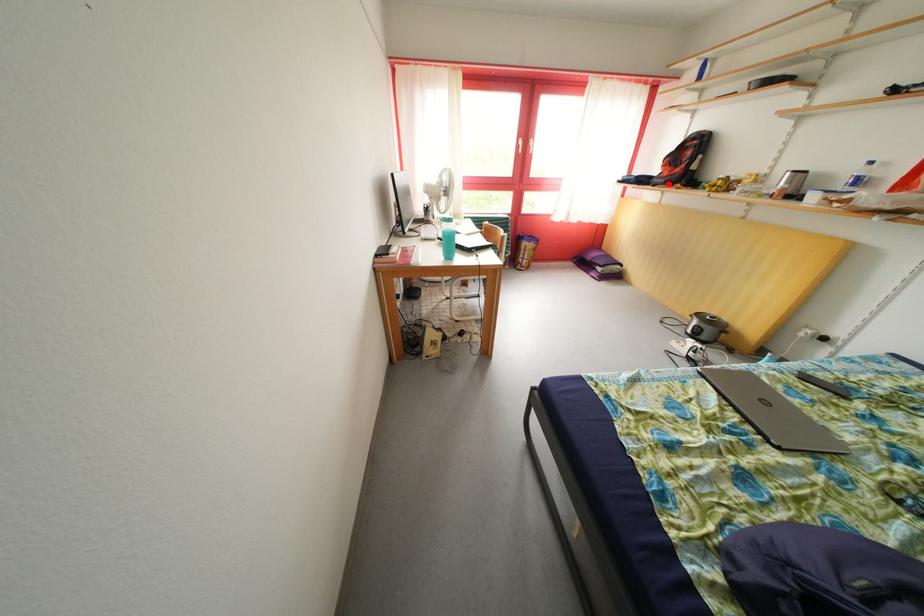
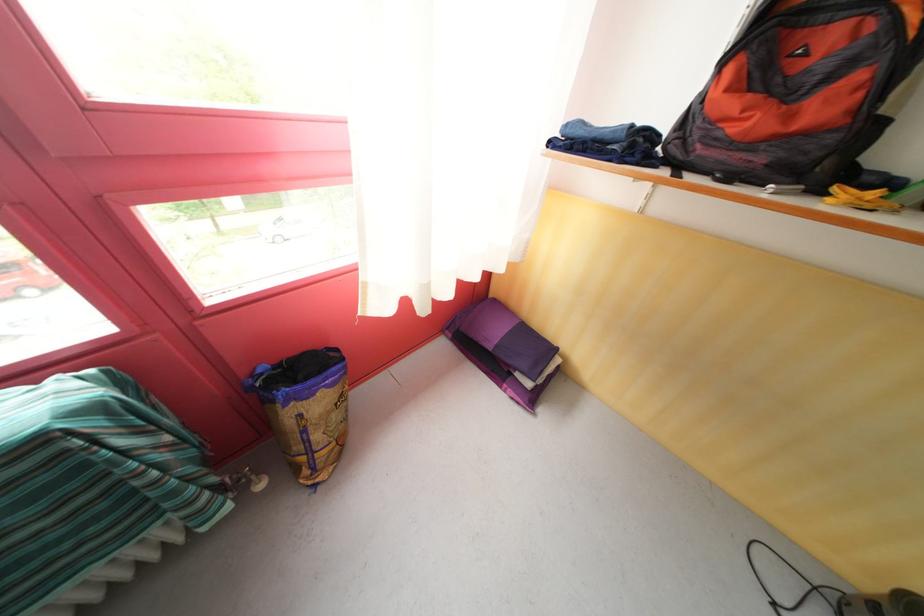
Question: I am providing you with two images of the same scene from different viewpoints. In image1, a red point is highlighted. Considering the same 3D point in image2, which of the following is correct?

Choices:
 (A) It is closer
 (B) It is farther

Answer: (B)